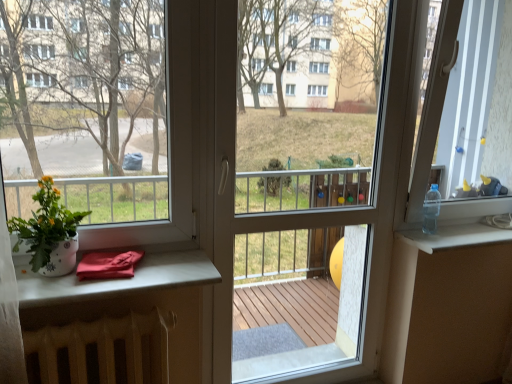
Locate an element on the screen. Image resolution: width=512 pixels, height=384 pixels. vacant space to the right of clear plastic bottle at upper right is located at coordinates (458, 234).